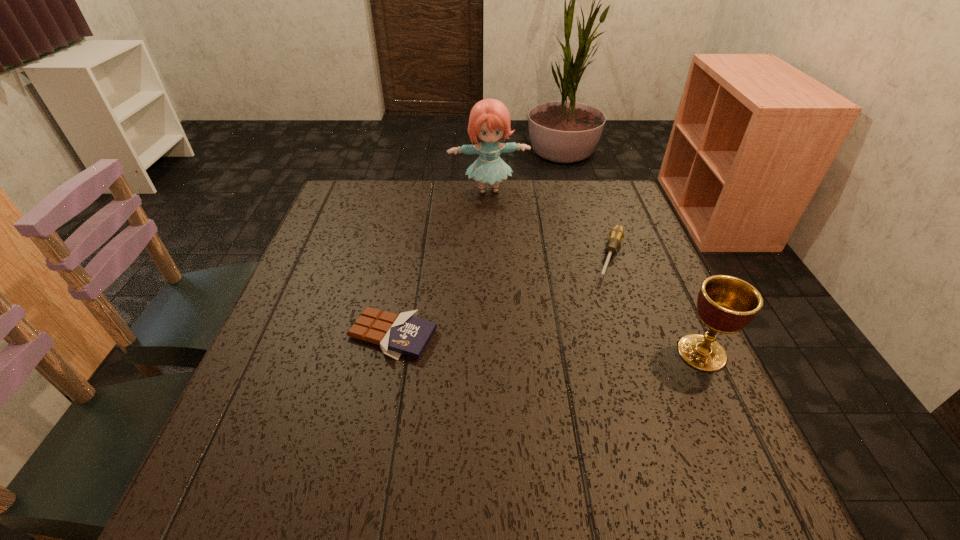
Identify the location of free region located 0.260m at the tip of the screwdriver. (585, 363).

At what (x,y) coordinates should I click in order to perform the action: click on free space located 0.300m at the tip of the screwdriver. Please return your answer as a coordinate pair (x, y). Looking at the image, I should click on (580, 378).

The image size is (960, 540). Find the location of `blank area located 0.100m on the front-facing side of the tallest object`. blank area located 0.100m on the front-facing side of the tallest object is located at coordinates (498, 221).

Find the location of a particular element. free location located 0.260m on the front-facing side of the tallest object is located at coordinates (507, 257).

At what (x,y) coordinates should I click in order to perform the action: click on free space located on the front-facing side of the tallest object. Please return your answer as a coordinate pair (x, y). Looking at the image, I should click on (505, 250).

This screenshot has width=960, height=540. I want to click on object located in the far edge section of the desktop, so click(x=489, y=120).

I want to click on chalice situated at the right edge, so click(x=726, y=304).

Where is `screwdriver that is at the right edge`? screwdriver that is at the right edge is located at coordinates (616, 235).

The image size is (960, 540). I want to click on free spot at the far edge of the desktop, so click(x=527, y=211).

The height and width of the screenshot is (540, 960). I want to click on vacant point at the near edge, so click(331, 432).